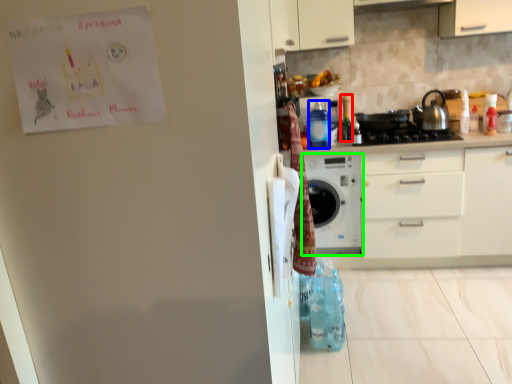
Question: Considering the real-world distances, which object is farthest from bottle (highlighted by a red box)? bottle (highlighted by a blue box) or home appliance (highlighted by a green box)?

Choices:
 (A) bottle
 (B) home appliance

Answer: (B)